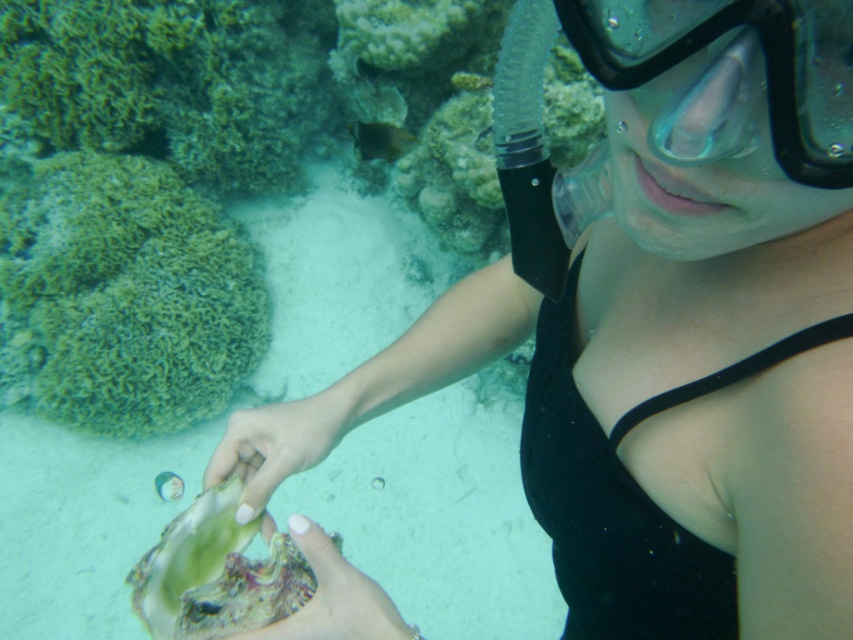
Question: Can you confirm if green soft coral at left is wider than transparent rubber goggles at upper center?

Choices:
 (A) no
 (B) yes

Answer: (B)

Question: Among these objects, which one is farthest from the camera?

Choices:
 (A) green soft coral at left
 (B) transparent rubber goggles at upper center

Answer: (A)

Question: Which object is closer to the camera taking this photo?

Choices:
 (A) pale skin at center
 (B) transparent rubber goggles at upper center
 (C) green iridescent shell at center

Answer: (B)

Question: Can you confirm if green soft coral at left is thinner than pale skin at center?

Choices:
 (A) no
 (B) yes

Answer: (A)

Question: Can you confirm if green soft coral at left is smaller than pale skin at center?

Choices:
 (A) yes
 (B) no

Answer: (B)

Question: Based on their relative distances, which object is farther from the transparent rubber goggles at upper center?

Choices:
 (A) pale skin at center
 (B) green soft coral at left

Answer: (B)